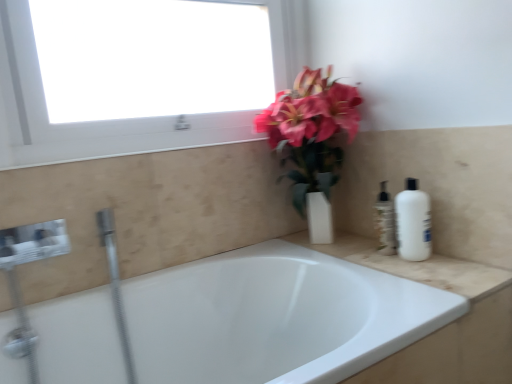
Question: Considering the relative sizes of white matte bottle at right and white glossy window at upper left in the image provided, is white matte bottle at right smaller than white glossy window at upper left?

Choices:
 (A) no
 (B) yes

Answer: (B)

Question: Considering the relative sizes of white matte bottle at right and white glossy window at upper left in the image provided, is white matte bottle at right thinner than white glossy window at upper left?

Choices:
 (A) yes
 (B) no

Answer: (A)

Question: Is white matte bottle at right at the right side of white glossy window at upper left?

Choices:
 (A) no
 (B) yes

Answer: (B)

Question: Could white glossy window at upper left be considered to be inside white matte bottle at right?

Choices:
 (A) yes
 (B) no

Answer: (B)

Question: From a real-world perspective, is white matte bottle at right positioned over white glossy window at upper left based on gravity?

Choices:
 (A) yes
 (B) no

Answer: (B)

Question: From the image's perspective, is matte white vase at upper center located above or below white glossy window at upper left?

Choices:
 (A) below
 (B) above

Answer: (A)

Question: Is matte white vase at upper center in front of or behind white glossy window at upper left in the image?

Choices:
 (A) behind
 (B) front

Answer: (A)

Question: Based on their sizes in the image, would you say matte white vase at upper center is bigger or smaller than white glossy window at upper left?

Choices:
 (A) big
 (B) small

Answer: (B)

Question: From a real-world perspective, relative to white glossy window at upper left, is matte white vase at upper center vertically above or below?

Choices:
 (A) above
 (B) below

Answer: (B)

Question: Looking at their shapes, would you say white glossy window at upper left is wider or thinner than white glossy bathtub at center?

Choices:
 (A) wide
 (B) thin

Answer: (B)

Question: From the image's perspective, is white glossy window at upper left located above or below white glossy bathtub at center?

Choices:
 (A) above
 (B) below

Answer: (A)

Question: Considering the positions of white glossy window at upper left and white glossy bathtub at center in the image, is white glossy window at upper left taller or shorter than white glossy bathtub at center?

Choices:
 (A) tall
 (B) short

Answer: (B)

Question: From a real-world perspective, is white glossy window at upper left positioned above or below white glossy bathtub at center?

Choices:
 (A) below
 (B) above

Answer: (B)

Question: Considering the positions of point pyautogui.click(x=387, y=208) and point pyautogui.click(x=281, y=266), is point pyautogui.click(x=387, y=208) closer or farther from the camera than point pyautogui.click(x=281, y=266)?

Choices:
 (A) farther
 (B) closer

Answer: (B)

Question: From the image's perspective, is translucent plastic soap dispenser at right located above or below white glossy bathtub at center?

Choices:
 (A) below
 (B) above

Answer: (B)